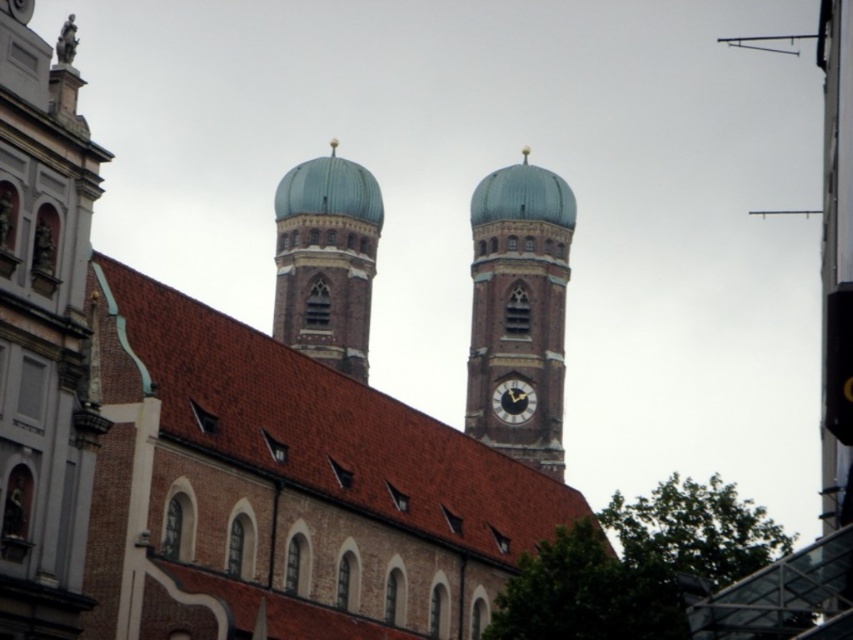
Identify the location of blue-tiled clock tower at center. This screenshot has width=853, height=640. (519, 312).

Does blue-tiled clock tower at center have a greater width compared to dark brown wooden clock at center?

Yes.

Who is more distant from viewer, (514, 444) or (511, 419)?

Positioned behind is point (511, 419).

The width and height of the screenshot is (853, 640). I want to click on blue-tiled clock tower at center, so click(x=519, y=312).

Who is positioned more to the left, brown brick church at center or dark brown wooden clock at center?

From the viewer's perspective, brown brick church at center appears more on the left side.

Between point (351, 369) and point (494, 394), which one is positioned behind?

Positioned behind is point (351, 369).

Which is in front, point (161, 372) or point (521, 396)?

Point (161, 372) is more forward.

Find the location of a particular element. This screenshot has width=853, height=640. brown brick church at center is located at coordinates (254, 408).

Does teal glazed dome at center appear on the left side of dark brown wooden clock at center?

Correct, you'll find teal glazed dome at center to the left of dark brown wooden clock at center.

Can you confirm if teal glazed dome at center is positioned to the right of dark brown wooden clock at center?

In fact, teal glazed dome at center is to the left of dark brown wooden clock at center.

Is point (379, 204) more distant than point (506, 406)?

Yes, it is.

This screenshot has width=853, height=640. I want to click on teal glazed dome at center, so click(326, 260).